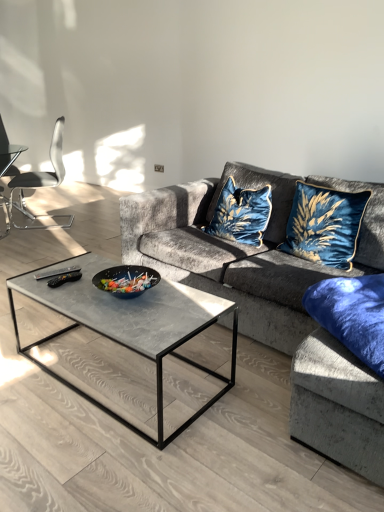
The width and height of the screenshot is (384, 512). Describe the element at coordinates (273, 300) in the screenshot. I see `velvet fabric couch at center` at that location.

Where is `velvet fabric couch at center`? velvet fabric couch at center is located at coordinates (273, 300).

What is the approximate height of blue velvet pillow at lower right?

7.22 inches.

I want to click on concrete gray coffee table at center, so click(x=11, y=156).

What do you see at coordinates (241, 214) in the screenshot?
I see `velvet blue cat-shaped pillow at center, arranged as the 1th throw pillow when viewed from the left` at bounding box center [241, 214].

Where is `velvet blue cat-shaped pillow at center, which appears as the 2th throw pillow when viewed from the right`? velvet blue cat-shaped pillow at center, which appears as the 2th throw pillow when viewed from the right is located at coordinates (241, 214).

What is the approximate width of velvet blue cushion at upper right, the 2th throw pillow when ordered from left to right?

It is 9.78 inches.

Where is `velvet blue cushion at upper right, the 2th throw pillow when ordered from left to right`? velvet blue cushion at upper right, the 2th throw pillow when ordered from left to right is located at coordinates (325, 225).

Locate an element on the screen. metallic silver chair at left is located at coordinates (42, 182).

Locate an element on the screen. velvet fabric couch at center is located at coordinates (273, 300).

Identify the location of the 2nd throw pillow located above the metallic silver chair at left (from a real-world perspective). This screenshot has height=512, width=384. (325, 225).

From a real-world perspective, is metallic silver chair at left physically located above or below velvet blue cushion at upper right, the 2th throw pillow when ordered from left to right?

→ Clearly, from a real-world perspective, metallic silver chair at left is below velvet blue cushion at upper right, the 2th throw pillow when ordered from left to right.

Is metallic silver chair at left wider or thinner than velvet blue cushion at upper right, the 2th throw pillow when ordered from left to right?

In the image, metallic silver chair at left appears to be wider than velvet blue cushion at upper right, the 2th throw pillow when ordered from left to right.

Which is in front, point (23, 173) or point (296, 244)?

Point (296, 244)

From the image's perspective, is blue velvet pillow at lower right above velvet fabric couch at center?

No, from the image's perspective, blue velvet pillow at lower right is not over velvet fabric couch at center.

How many degrees apart are the facing directions of blue velvet pillow at lower right and velvet fabric couch at center?

The angular difference between blue velvet pillow at lower right and velvet fabric couch at center is 24.4 degrees.

Considering their positions, is blue velvet pillow at lower right located in front of or behind velvet fabric couch at center?

Visually, blue velvet pillow at lower right is located behind velvet fabric couch at center.

You are a GUI agent. You are given a task and a screenshot of the screen. Output one action in this format:
    pyautogui.click(x=<x>, y=<y>)
    Task: Click on the pillow on the right side of velvet fabric couch at center
    Image resolution: width=384 pixels, height=512 pixels.
    Given the screenshot: What is the action you would take?
    pyautogui.click(x=352, y=315)

In terms of height, does metallic silver chair at left look taller or shorter compared to velvet fabric couch at center?

In the image, metallic silver chair at left appears to be taller than velvet fabric couch at center.

Do you think metallic silver chair at left is within velvet fabric couch at center, or outside of it?

metallic silver chair at left is not enclosed by velvet fabric couch at center.

In order to click on studio couch that is below the metallic silver chair at left (from the image's perspective) in this screenshot , I will do `click(273, 300)`.

Consider the image. Considering the relative positions of metallic silver chair at left and velvet fabric couch at center in the image provided, is metallic silver chair at left to the left or to the right of velvet fabric couch at center?

Based on their positions, metallic silver chair at left is located to the left of velvet fabric couch at center.

Between concrete gray coffee table at center and blue velvet pillow at lower right, which one has larger size?

Bigger between the two is concrete gray coffee table at center.

How much distance is there between concrete gray coffee table at center and blue velvet pillow at lower right?

concrete gray coffee table at center is 4.68 meters away from blue velvet pillow at lower right.

Is concrete gray coffee table at center with blue velvet pillow at lower right?

No, concrete gray coffee table at center is not with blue velvet pillow at lower right.

Looking at this image, is concrete gray coffee table at center inside or outside of blue velvet pillow at lower right?

concrete gray coffee table at center exists outside the volume of blue velvet pillow at lower right.

Does velvet fabric couch at center lie behind velvet blue cat-shaped pillow at center, which appears as the 2th throw pillow when viewed from the right?

No.

From the image's perspective, is velvet fabric couch at center over velvet blue cat-shaped pillow at center, which appears as the 2th throw pillow when viewed from the right?

No, from the image's perspective, velvet fabric couch at center is not over velvet blue cat-shaped pillow at center, which appears as the 2th throw pillow when viewed from the right.

Does velvet fabric couch at center contain velvet blue cat-shaped pillow at center, arranged as the 1th throw pillow when viewed from the left?

Yes, velvet blue cat-shaped pillow at center, arranged as the 1th throw pillow when viewed from the left, is a part of velvet fabric couch at center.

From their relative heights in the image, would you say velvet fabric couch at center is taller or shorter than velvet blue cat-shaped pillow at center, arranged as the 1th throw pillow when viewed from the left?

Clearly, velvet fabric couch at center is taller compared to velvet blue cat-shaped pillow at center, arranged as the 1th throw pillow when viewed from the left.

Does velvet fabric couch at center appear on the left side of metallic silver chair at left?

No.

Which of these two, velvet fabric couch at center or metallic silver chair at left, is wider?

velvet fabric couch at center is wider.

Can you confirm if velvet fabric couch at center is bigger than metallic silver chair at left?

Indeed, velvet fabric couch at center has a larger size compared to metallic silver chair at left.

Does velvet fabric couch at center turn towards metallic silver chair at left?

No, velvet fabric couch at center does not turn towards metallic silver chair at left.

Is metallic silver chair at left oriented away from blue velvet pillow at lower right?

No, metallic silver chair at left's orientation is not away from blue velvet pillow at lower right.

Can you tell me how much metallic silver chair at left and blue velvet pillow at lower right differ in facing direction?

16.4 degrees.

Between metallic silver chair at left and blue velvet pillow at lower right, which one has smaller size?

blue velvet pillow at lower right is smaller.

Which is behind, metallic silver chair at left or blue velvet pillow at lower right?

metallic silver chair at left is behind.

Starting from the metallic silver chair at left, which throw pillow is the 2nd one in front? Please provide its 2D coordinates.

[(325, 225)]

At what (x,y) coordinates should I click in order to perform the action: click on studio couch above the blue velvet pillow at lower right (from the image's perspective). Please return your answer as a coordinate pair (x, y). Image resolution: width=384 pixels, height=512 pixels. Looking at the image, I should click on (273, 300).

From the image, which object appears to be nearer to metallic silver chair at left, velvet blue cat-shaped pillow at center, arranged as the 1th throw pillow when viewed from the left, or velvet blue cushion at upper right, the 2th throw pillow when ordered from left to right?

velvet blue cat-shaped pillow at center, arranged as the 1th throw pillow when viewed from the left, lies closer to metallic silver chair at left than the other object.

Considering their positions, is velvet blue cushion at upper right, the 2th throw pillow when ordered from left to right, positioned closer to velvet blue cat-shaped pillow at center, which appears as the 2th throw pillow when viewed from the right, than velvet fabric couch at center?

Based on the image, velvet fabric couch at center appears to be nearer to velvet blue cat-shaped pillow at center, which appears as the 2th throw pillow when viewed from the right.

Estimate the real-world distances between objects in this image. Which object is closer to concrete gray coffee table at center, velvet fabric couch at center or velvet blue cat-shaped pillow at center, which appears as the 2th throw pillow when viewed from the right?

velvet blue cat-shaped pillow at center, which appears as the 2th throw pillow when viewed from the right, lies closer to concrete gray coffee table at center than the other object.

From the image, which object appears to be farther from velvet blue cushion at upper right, which is the first throw pillow from right to left, concrete gray coffee table at center or velvet blue cat-shaped pillow at center, arranged as the 1th throw pillow when viewed from the left?

Among the two, concrete gray coffee table at center is located further to velvet blue cushion at upper right, which is the first throw pillow from right to left.

Estimate the real-world distances between objects in this image. Which object is further from velvet blue cushion at upper right, the 2th throw pillow when ordered from left to right, concrete gray coffee table at center or metallic silver chair at left?

metallic silver chair at left is positioned further to the anchor velvet blue cushion at upper right, the 2th throw pillow when ordered from left to right.

When comparing their distances from blue velvet pillow at lower right, does metallic silver chair at left or velvet blue cushion at upper right, which is the first throw pillow from right to left, seem closer?

The object closer to blue velvet pillow at lower right is velvet blue cushion at upper right, which is the first throw pillow from right to left.

Consider the image. Based on their spatial positions, is concrete gray coffee table at center or blue velvet pillow at lower right closer to velvet blue cat-shaped pillow at center, arranged as the 1th throw pillow when viewed from the left?

blue velvet pillow at lower right lies closer to velvet blue cat-shaped pillow at center, arranged as the 1th throw pillow when viewed from the left, than the other object.

Estimate the real-world distances between objects in this image. Which object is closer to velvet blue cushion at upper right, which is the first throw pillow from right to left, velvet blue cat-shaped pillow at center, arranged as the 1th throw pillow when viewed from the left, or concrete gray coffee table at center?

velvet blue cat-shaped pillow at center, arranged as the 1th throw pillow when viewed from the left, is closer to velvet blue cushion at upper right, which is the first throw pillow from right to left.

Image resolution: width=384 pixels, height=512 pixels. Identify the location of chair located between blue velvet pillow at lower right and concrete gray coffee table at center in the depth direction. (42, 182).

Identify the location of pillow located between velvet fabric couch at center and velvet blue cushion at upper right, which is the first throw pillow from right to left, in the depth direction. This screenshot has width=384, height=512. (352, 315).

Find the location of a particular element. Image resolution: width=384 pixels, height=512 pixels. pillow between velvet fabric couch at center and velvet blue cat-shaped pillow at center, which appears as the 2th throw pillow when viewed from the right, from front to back is located at coordinates (352, 315).

Where is `chair between velvet fabric couch at center and concrete gray coffee table at center along the z-axis`? This screenshot has width=384, height=512. chair between velvet fabric couch at center and concrete gray coffee table at center along the z-axis is located at coordinates (42, 182).